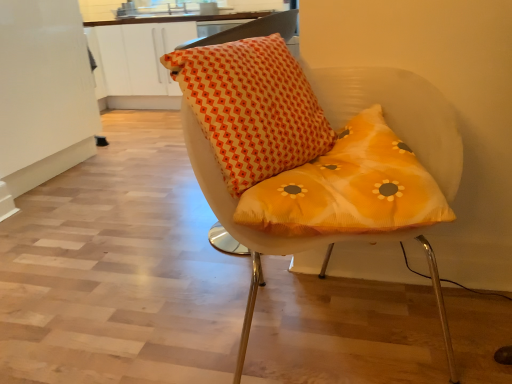
Question: Is point [x=241, y=187] positioned closer to the camera than point [x=417, y=157]?

Choices:
 (A) closer
 (B) farther

Answer: (A)

Question: Would you say orange printed cushion at center is to the left or to the right of matte orange cushion at center in the picture?

Choices:
 (A) left
 (B) right

Answer: (A)

Question: In terms of width, does orange printed cushion at center look wider or thinner when compared to matte orange cushion at center?

Choices:
 (A) thin
 (B) wide

Answer: (A)

Question: Choose the correct answer: Is matte orange cushion at center inside orange printed cushion at center or outside it?

Choices:
 (A) inside
 (B) outside

Answer: (B)

Question: Considering the positions of matte orange cushion at center and orange printed cushion at center in the image, is matte orange cushion at center wider or thinner than orange printed cushion at center?

Choices:
 (A) thin
 (B) wide

Answer: (B)

Question: From the image's perspective, is matte orange cushion at center positioned above or below orange printed cushion at center?

Choices:
 (A) below
 (B) above

Answer: (A)

Question: Considering the relative positions of matte orange cushion at center and orange printed cushion at center in the image provided, is matte orange cushion at center to the left or to the right of orange printed cushion at center?

Choices:
 (A) right
 (B) left

Answer: (A)